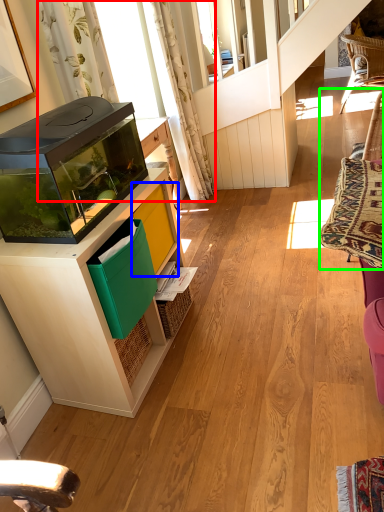
Question: Which object is positioned farthest from curtain (highlighted by a red box)? Select from shelf (highlighted by a blue box) and swivel chair (highlighted by a green box).

Choices:
 (A) shelf
 (B) swivel chair

Answer: (B)